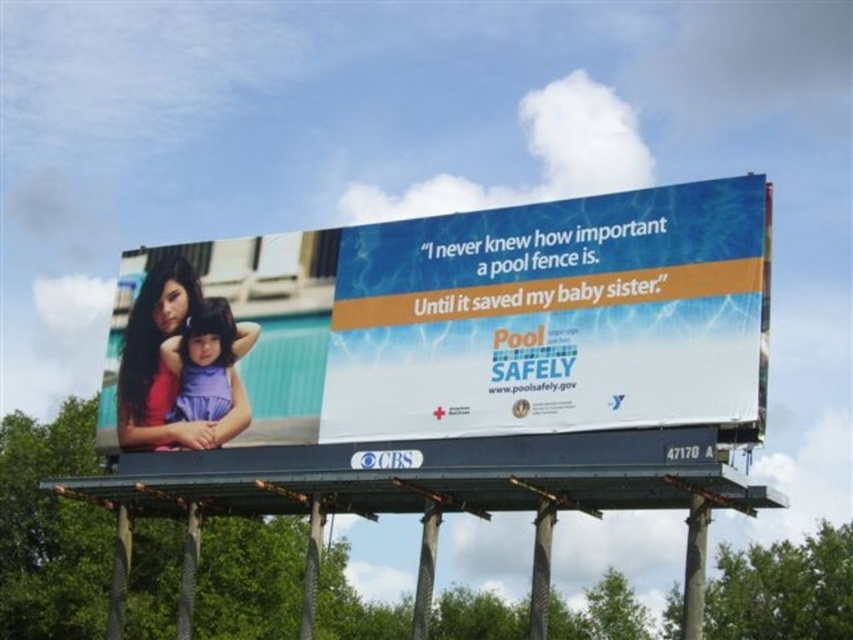
Question: Does matte white billboard at center appear over purple fabric at left?

Choices:
 (A) yes
 (B) no

Answer: (A)

Question: Which point is farther to the camera?

Choices:
 (A) matte white billboard at center
 (B) purple fabric at left

Answer: (B)

Question: Considering the relative positions of matte white billboard at center and purple fabric at left in the image provided, where is matte white billboard at center located with respect to purple fabric at left?

Choices:
 (A) right
 (B) left

Answer: (A)

Question: Among these points, which one is farthest from the camera?

Choices:
 (A) (540, 374)
 (B) (219, 374)

Answer: (B)

Question: Can you confirm if matte white billboard at center is positioned above purple fabric at left?

Choices:
 (A) yes
 (B) no

Answer: (A)

Question: Which point is farther from the camera taking this photo?

Choices:
 (A) (740, 269)
 (B) (248, 340)

Answer: (B)